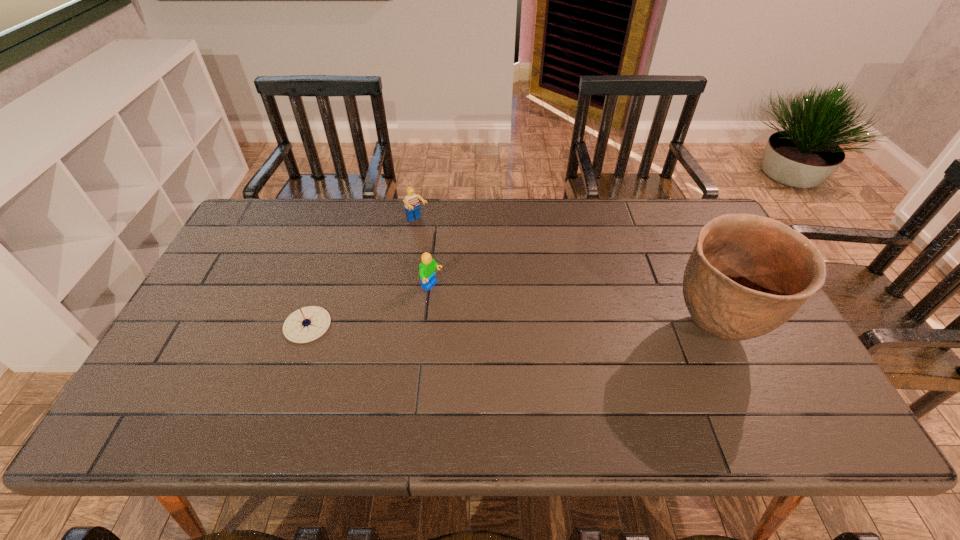
Image resolution: width=960 pixels, height=540 pixels. Identify the location of free spot on the desktop that is between the shortest object and the tallest object and is positioned on the face of the farthest object. (515, 327).

Locate an element on the screen. The image size is (960, 540). free space on the desktop that is between the shortest object and the rightmost object and is positioned on the face of the nearer Lego is located at coordinates (507, 327).